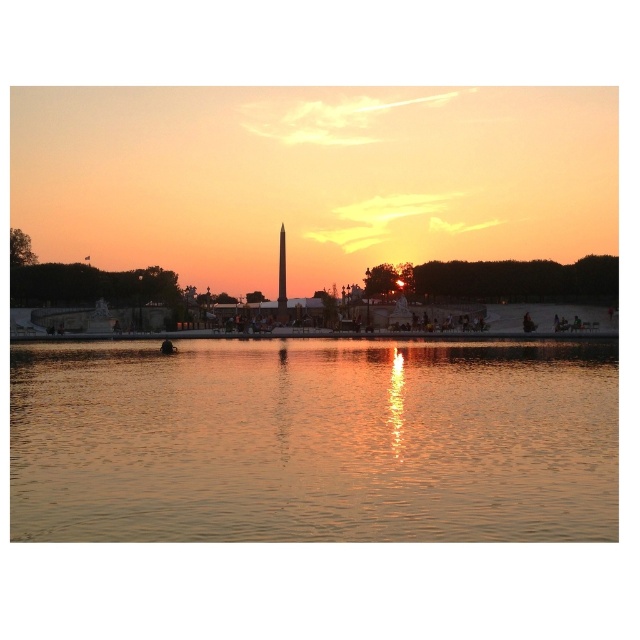
Which is more to the left, golden reflective water at center or polished stone obelisk at center?

polished stone obelisk at center

Which is behind, point (148, 451) or point (282, 285)?

The point (282, 285) is behind.

This screenshot has height=640, width=640. Describe the element at coordinates (314, 442) in the screenshot. I see `golden reflective water at center` at that location.

Identify the location of golden reflective water at center. The height and width of the screenshot is (640, 640). (314, 442).